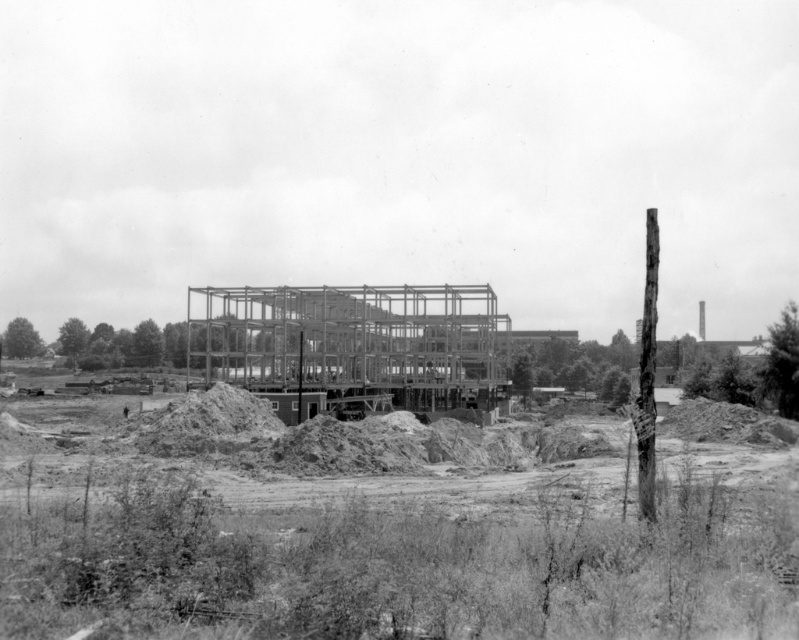
You are a construction worker who needs to place a heavy equipment on the dirt at center. However, there is a metallic framework at center nearby. From your perspective, which object is located to the right side of the other?

The dirt at center is positioned on the right side of metallic framework at center, so the dirt at center is to the right of the metallic framework at center.

You are a construction worker standing at point A. You need to move a heavy equipment from your current position to the location marked by point B. The coordinates for point A are at the base of the steel beams framework, and point B is at point [378,540]. What kind of terrain will you encounter when moving towards point B?

The terrain at point [378,540] is dirt at center, so you will encounter dirt terrain when moving towards point B.